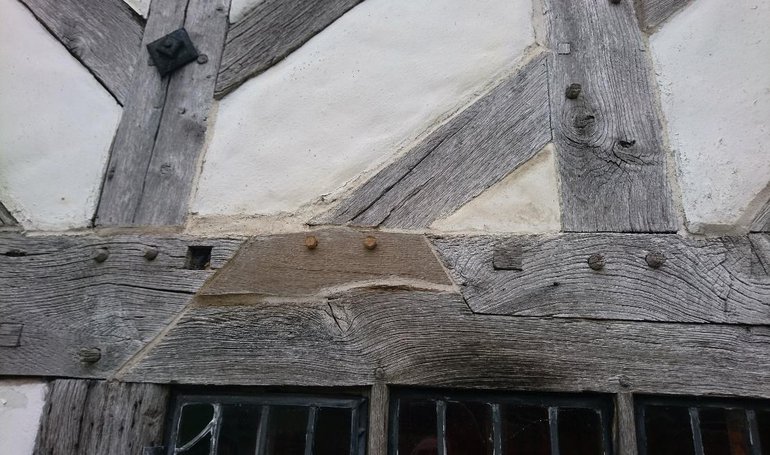
At what (x,y) coordinates should I click in order to perform the action: click on horizontal boards. Please return your answer as a coordinate pair (x, y). Looking at the image, I should click on (238, 332).